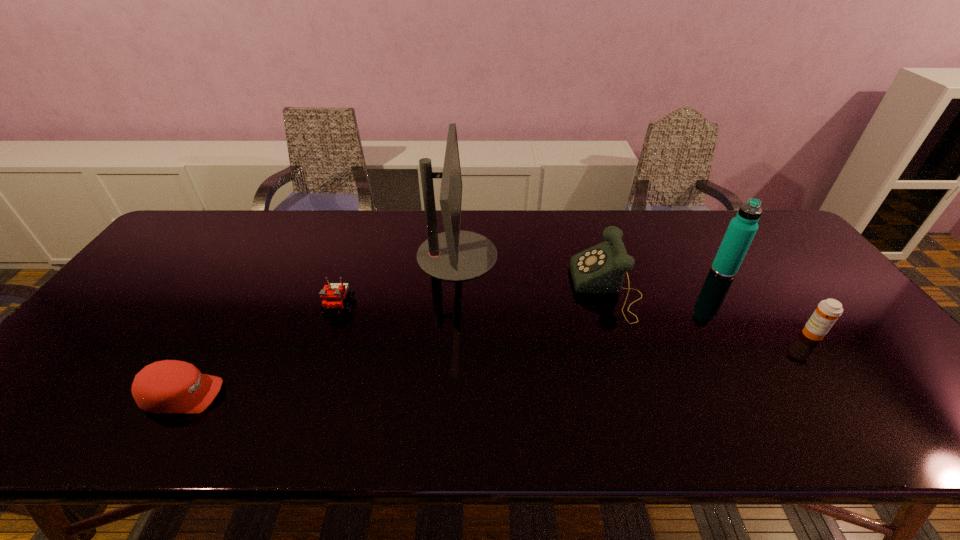
Find the location of a particular element. The width and height of the screenshot is (960, 540). the tallest object is located at coordinates (454, 255).

At what (x,y) coordinates should I click in order to perform the action: click on the fourth object from right to left. Please return your answer as a coordinate pair (x, y). Looking at the image, I should click on (454, 255).

The image size is (960, 540). I want to click on water bottle, so click(x=742, y=228).

Identify the location of the fifth object from left to right. (742, 228).

The image size is (960, 540). Identify the location of telephone. (601, 268).

I want to click on the third tallest object, so tap(601, 268).

In order to click on medicine in this screenshot , I will do `click(827, 312)`.

This screenshot has height=540, width=960. Identify the location of the fourth tallest object. (827, 312).

At what (x,y) coordinates should I click in order to perform the action: click on the second object from left to right. Please return your answer as a coordinate pair (x, y). The height and width of the screenshot is (540, 960). Looking at the image, I should click on (333, 295).

Where is `the nearest object`? The width and height of the screenshot is (960, 540). the nearest object is located at coordinates (170, 386).